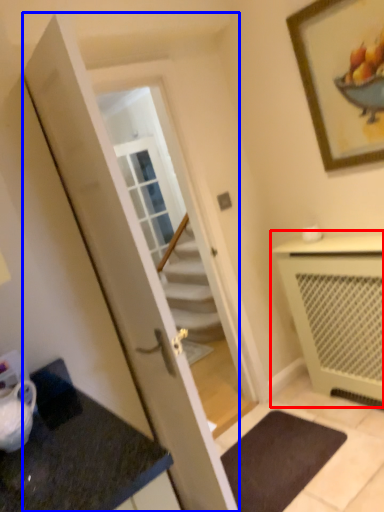
Question: Which object is closer to the camera taking this photo, cabinetry (highlighted by a red box) or door (highlighted by a blue box)?

Choices:
 (A) cabinetry
 (B) door

Answer: (B)